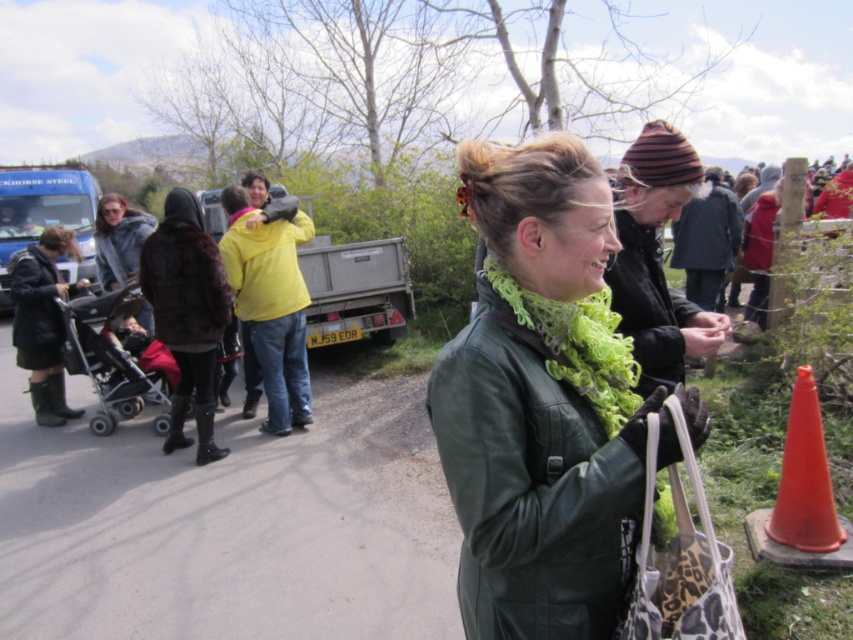
Does matte black boots at left appear under black leather jacket at left?

Yes, matte black boots at left is below black leather jacket at left.

Does point (59, 316) come closer to viewer compared to point (30, 337)?

No, it is not.

Identify the location of matte black boots at left. (42, 321).

Is the position of orange plastic traffic cone at lower right less distant than that of yellow matte jacket at center?

Yes.

Can you confirm if orange plastic traffic cone at lower right is positioned to the right of yellow matte jacket at center?

Indeed, orange plastic traffic cone at lower right is positioned on the right side of yellow matte jacket at center.

Where is `orange plastic traffic cone at lower right`? Image resolution: width=853 pixels, height=640 pixels. orange plastic traffic cone at lower right is located at coordinates (802, 496).

Find the location of a particular element. Image resolution: width=853 pixels, height=640 pixels. orange plastic traffic cone at lower right is located at coordinates (802, 496).

Does green leather jacket at center lie behind velvet brown jacket at center?

No, green leather jacket at center is in front of velvet brown jacket at center.

Is point (578, 440) closer to viewer compared to point (183, 349)?

Yes, point (578, 440) is closer to viewer.

Who is more forward, (601, 388) or (173, 289)?

Point (601, 388) is in front.

Identify the location of green leather jacket at center. The height and width of the screenshot is (640, 853). (x=543, y=401).